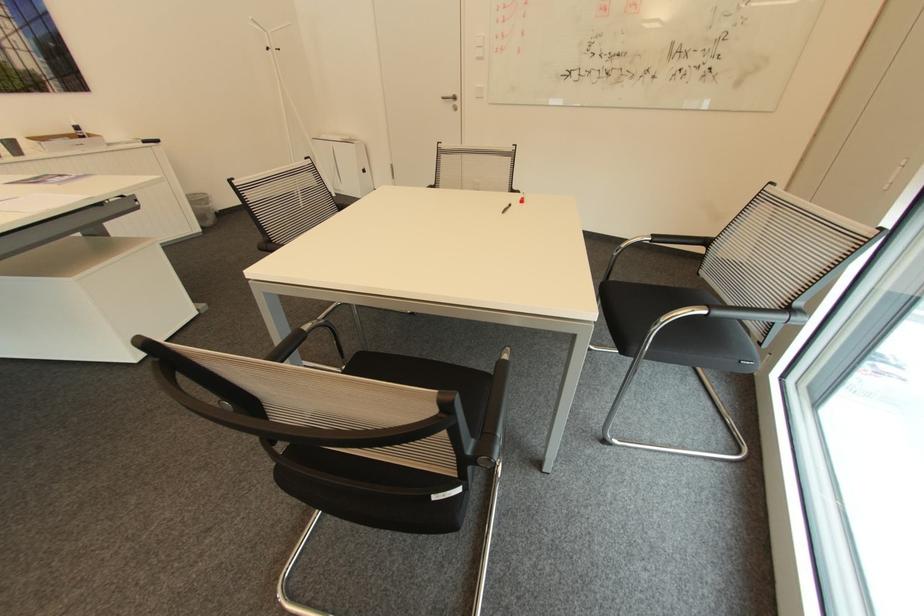
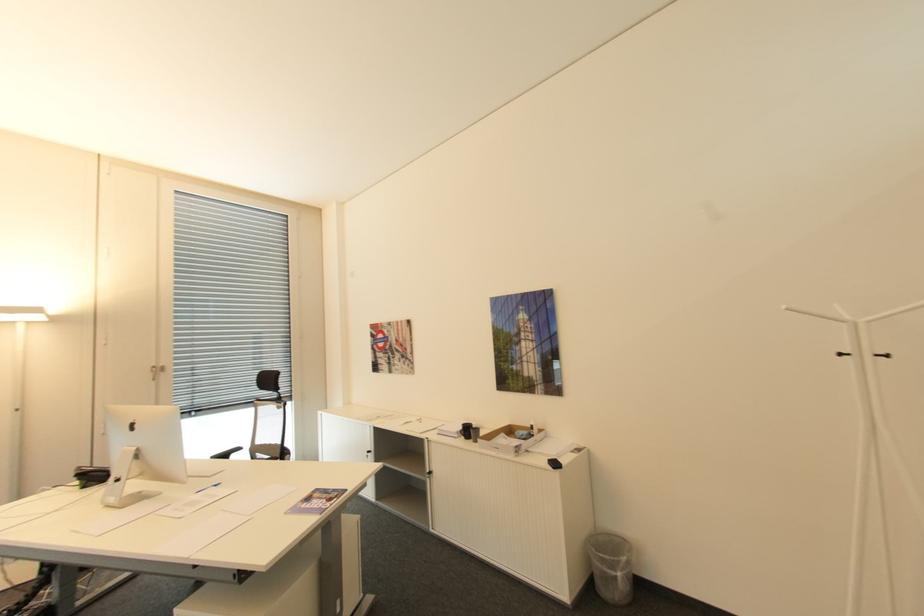
Where in the second image is the point corresponding to [284,50] from the first image?

(894, 355)